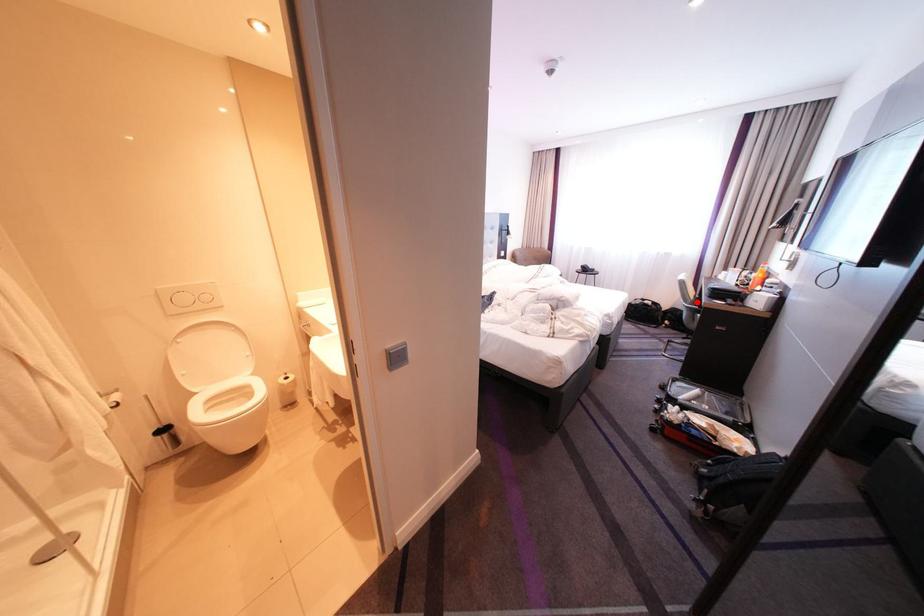
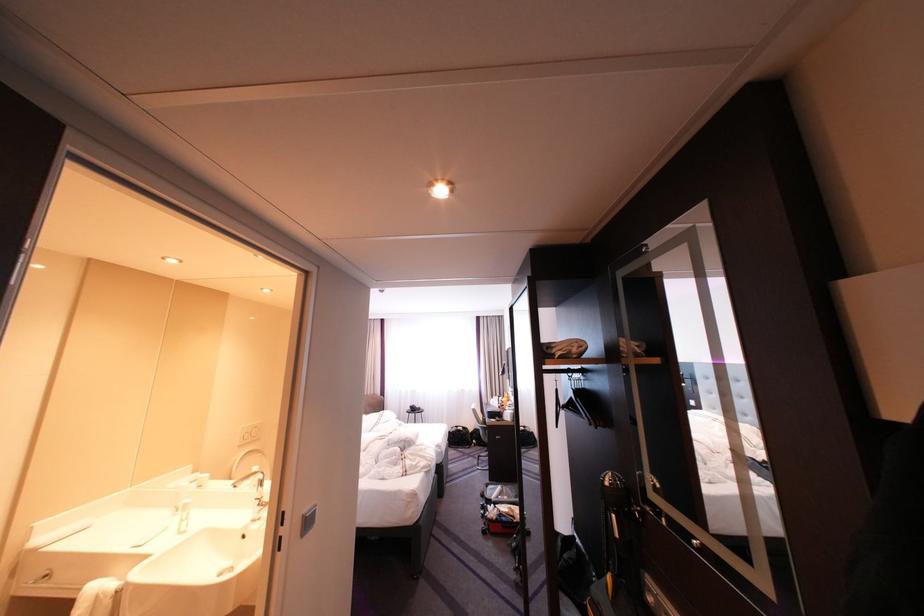
Question: A red point is marked in image1. In image2, is the corresponding 3D point closer to the camera or farther? Reply with the corresponding letter.

Choices:
 (A) The corresponding 3D point is closer.
 (B) The corresponding 3D point is farther.

Answer: (B)